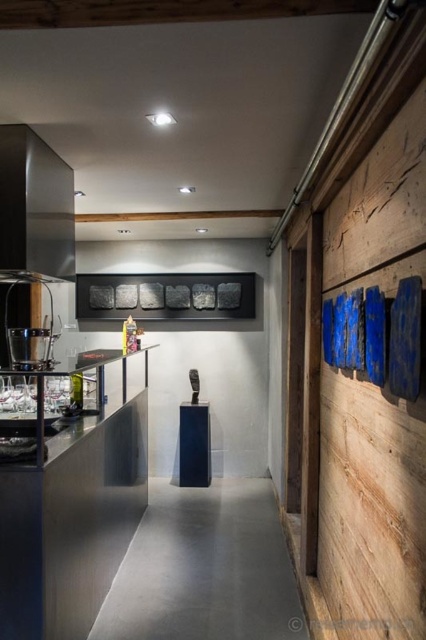
You are a customer trying to place an order at the stainless steel counter at left and the brushed metal coffee machine at left. Which object should you approach first if you want to order a coffee?

The brushed metal coffee machine at left is the correct object to approach for ordering coffee, as it is specifically designed for coffee preparation. The stainless steel counter at left may be for general use or other services.

You are a customer entering the space and want to order a drink. Which object should you approach first, the stainless steel counter at left or the satin black exhaust hood at upper left?

The stainless steel counter at left is located below the satin black exhaust hood at upper left. Since the counter is at a lower position and typically where drinks are served, you should approach the stainless steel counter at left first.

You are standing in the modern interior space and want to move from point A to point B. Point A is at coordinate point (37, 208) and point B is at coordinate point (29, 349). Which point is closer to you when you first enter the room?

Point A at coordinate point (37, 208) is closer to you because it is further to the viewer than point B at coordinate point (29, 349).